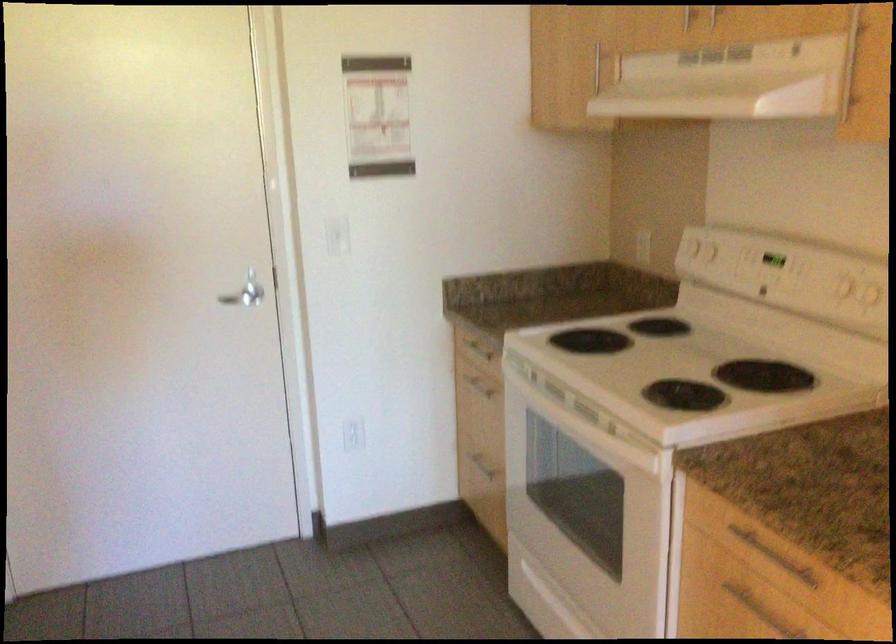
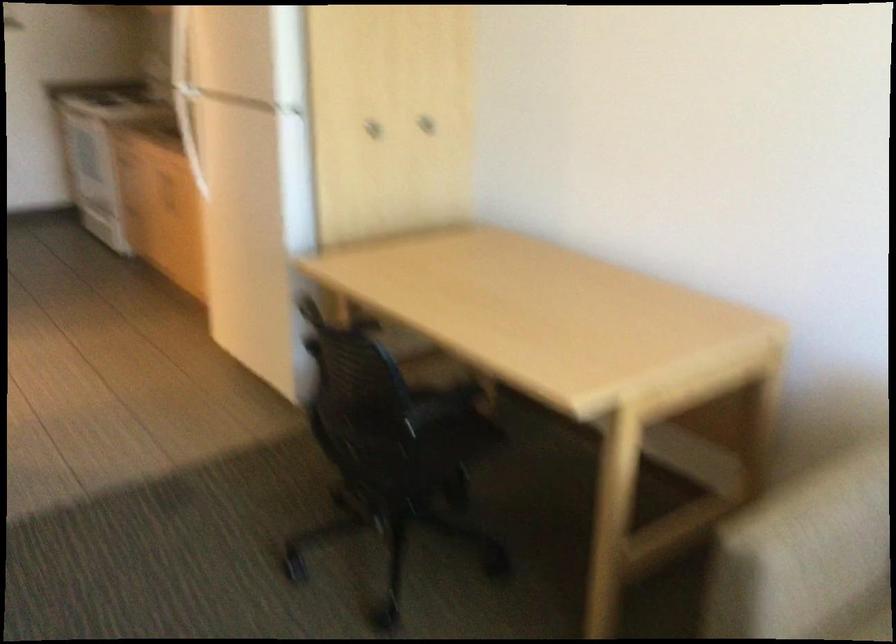
Question: I am providing you with two images of the same scene from different viewpoints. Please identify which objects are invisible in image2.

Choices:
 (A) refrigerator door handle
 (B) cabinet door knob
 (C) drawer handle
 (D) patterned backpack

Answer: (C)